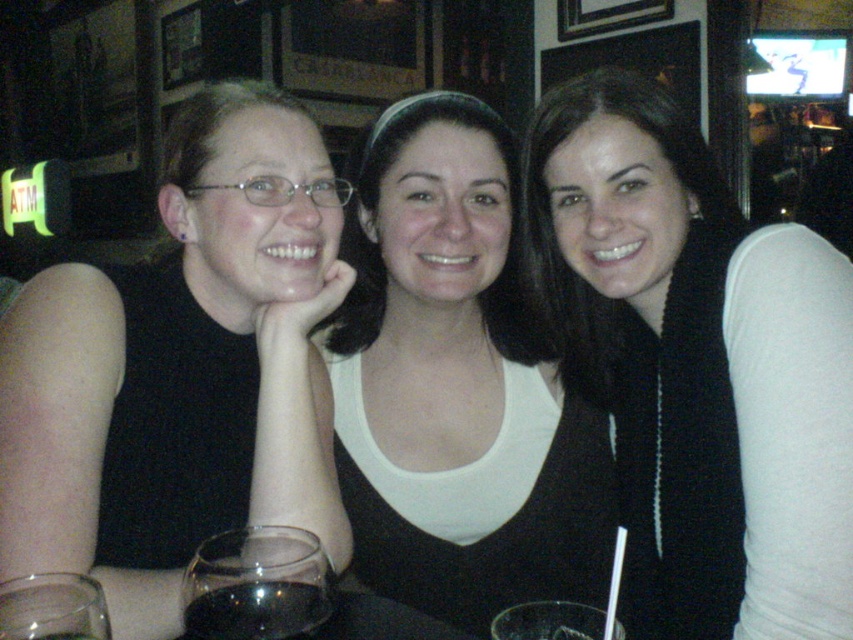
You are standing at the camera position and want to take a photo of the point at coordinates point (296, 275). Is the point within the camera frame?

The point (296, 275) is 1.15 meters from camera, so yes, it is within the camera frame.

In the scene shown: You are a photographer trying to capture a candid shot of the group. You notice the white matte tank top at center and the transparent glass at lower left. Which object should you focus on first if you want to ensure both are in focus without adjusting your camera settings?

The white matte tank top at center has a greater height compared to the transparent glass at lower left, so focusing on the white matte tank top at center first would help ensure both are in focus since it is larger and closer to the camera.